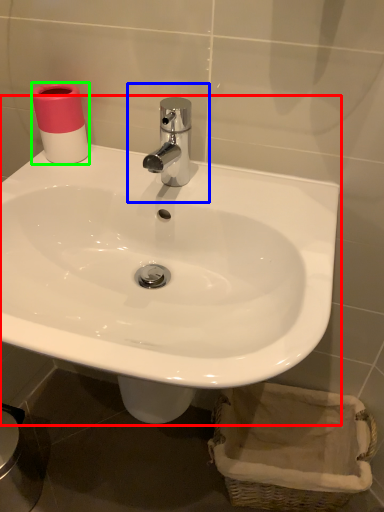
Question: Based on their relative distances, which object is farther from sink (highlighted by a red box)? Choose from plumbing fixture (highlighted by a blue box) and toilet paper (highlighted by a green box).

Choices:
 (A) plumbing fixture
 (B) toilet paper

Answer: (B)